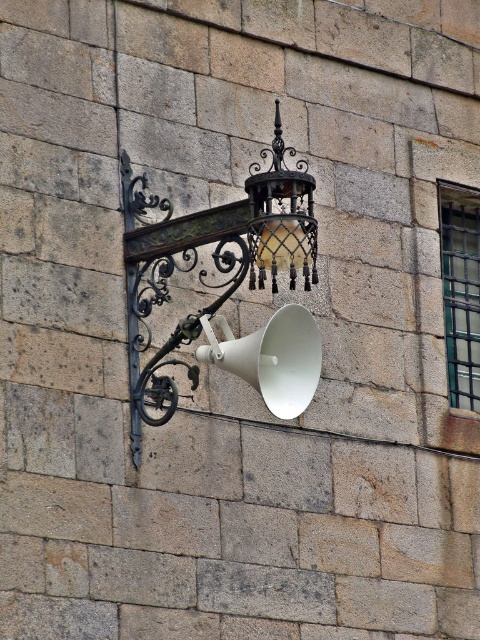
You are a maintenance worker needing to reach both the white matte megaphone at center and the matte black lantern at upper center for cleaning. Given that your ladder can extend up to 4 meters, will you be able to clean both objects without moving the ladder?

The distance between the white matte megaphone at center and the matte black lantern at upper center is 4.30 meters. Since your ladder can only extend up to 4 meters, you will not be able to reach both objects without moving the ladder.

You are an artist sketching the stone wall and its attached items. You need to draw the matte black lantern at center and the white matte megaphone at center accurately. Which one should you draw first if you want to start from the right side of the scene?

You should draw the white matte megaphone at center first because the matte black lantern at center is to the left of it, so starting from the right side means beginning with the white matte megaphone at center.

You are an architect designing a restoration project for this historical wall. You need to place a new light fixture exactly where the point at coordinates point (229, 289) is located. What object currently occupies that location?

The point at coordinates point (229, 289) corresponds to the matte black lantern at center, so the matte black lantern at center is currently at that location.